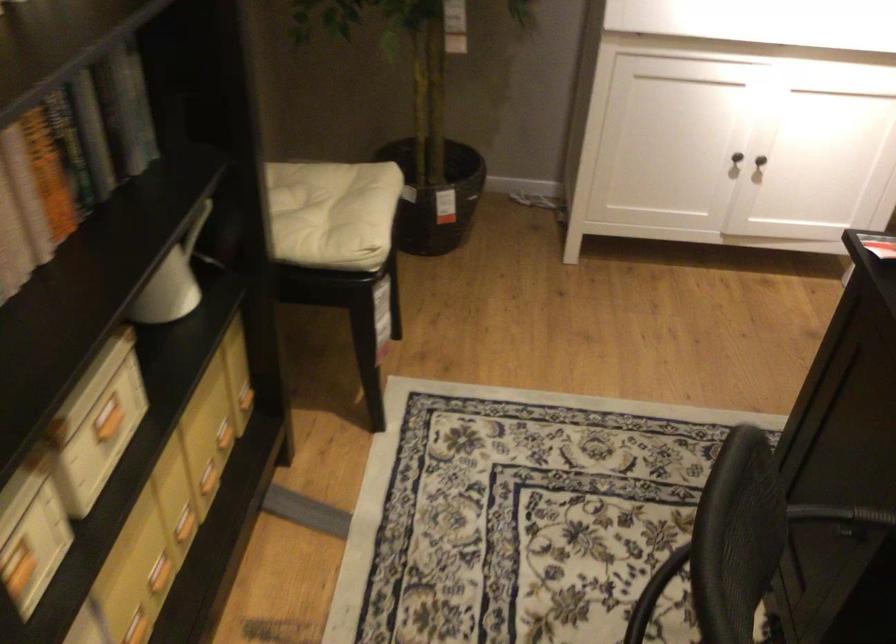
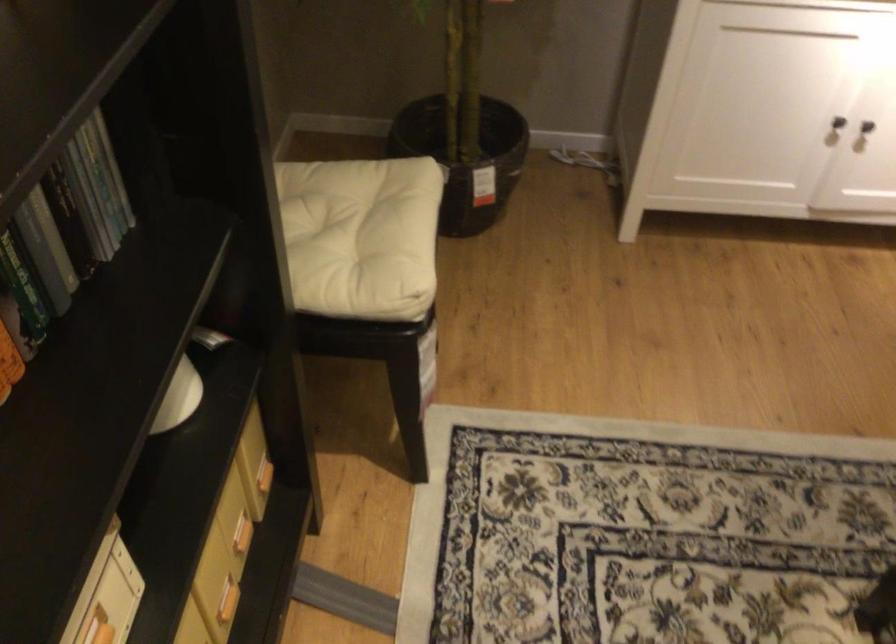
The point at (737, 158) is marked in the first image. Where is the corresponding point in the second image?

(838, 122)